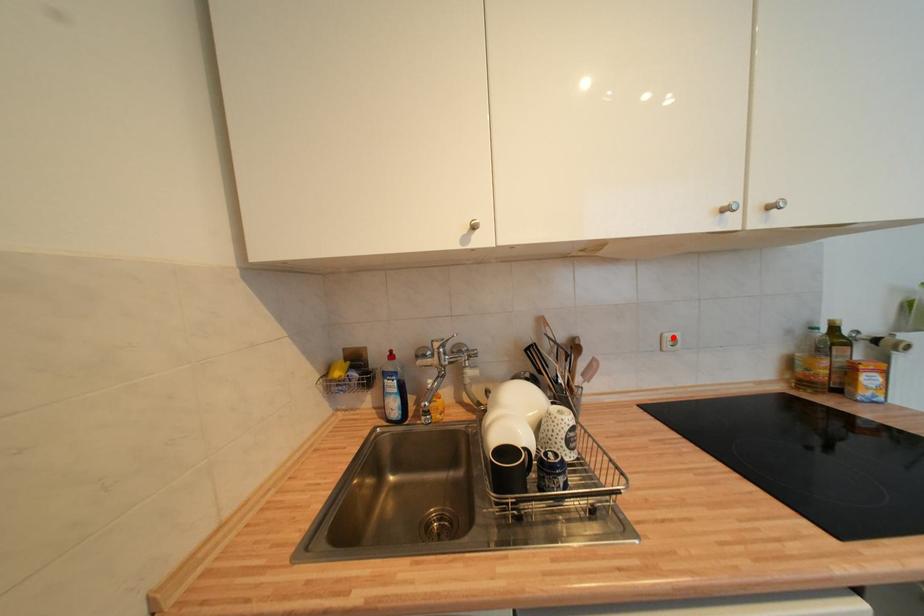
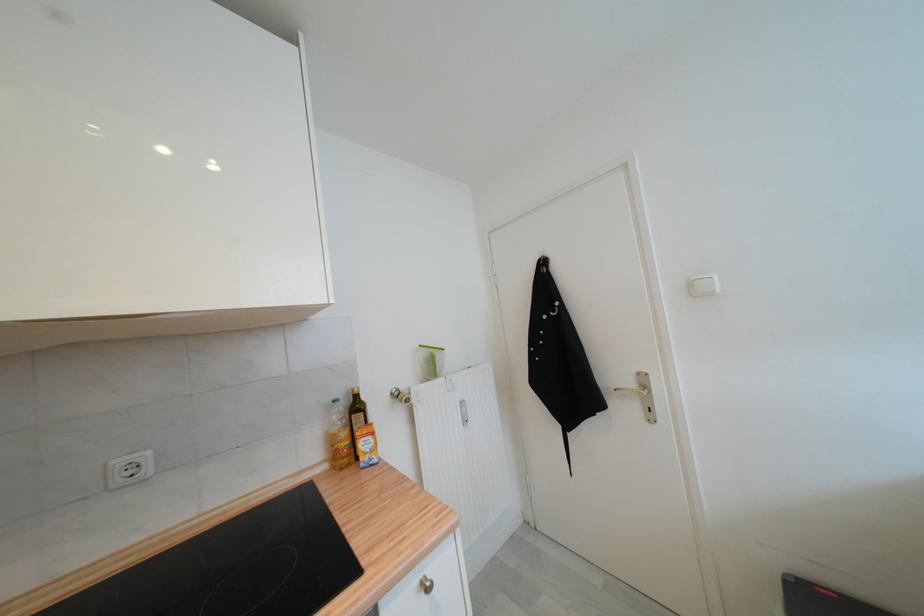
Question: I am providing you with two images of the same scene from different viewpoints. A red point is marked on the first image. Can you still see the location of the red point in image 2?

Choices:
 (A) Yes
 (B) No

Answer: (A)